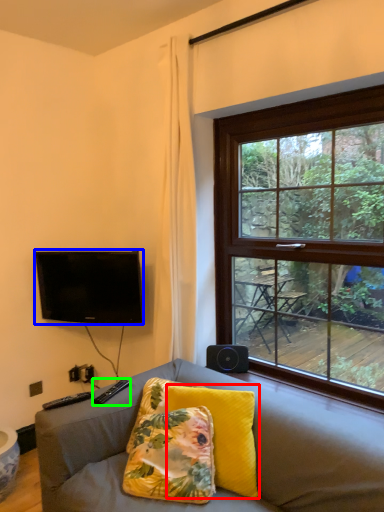
Question: Based on their relative distances, which object is nearer to pillow (highlighted by a red box)? Choose from television (highlighted by a blue box) and remote (highlighted by a green box).

Choices:
 (A) television
 (B) remote

Answer: (B)